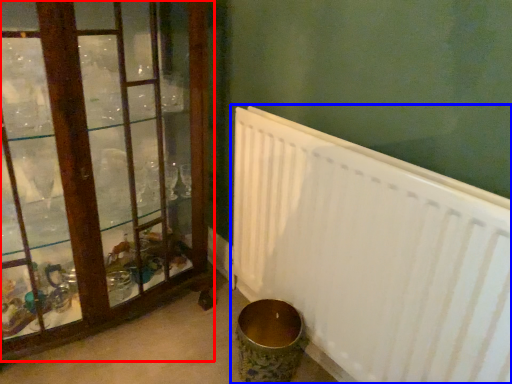
Question: Which object is closer to the camera taking this photo, window (highlighted by a red box) or radiator (highlighted by a blue box)?

Choices:
 (A) window
 (B) radiator

Answer: (B)